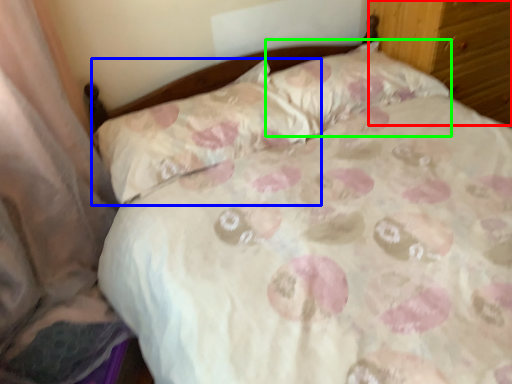
Question: Which is nearer to the dresser (highlighted by a red box)? pillow (highlighted by a blue box) or pillow (highlighted by a green box).

Choices:
 (A) pillow
 (B) pillow

Answer: (B)